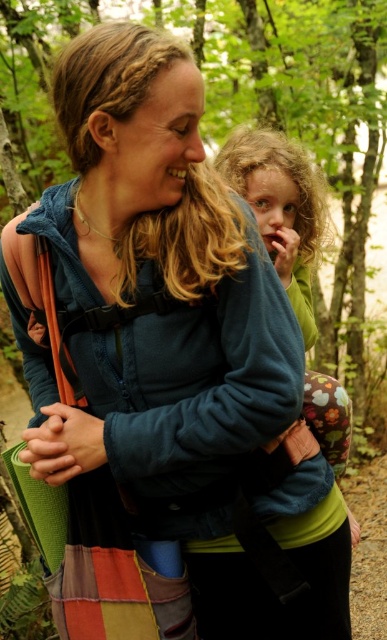
Looking at this image, what is the location of the fluffy green sweater at center in the image?

The fluffy green sweater at center is located at point (280,209).